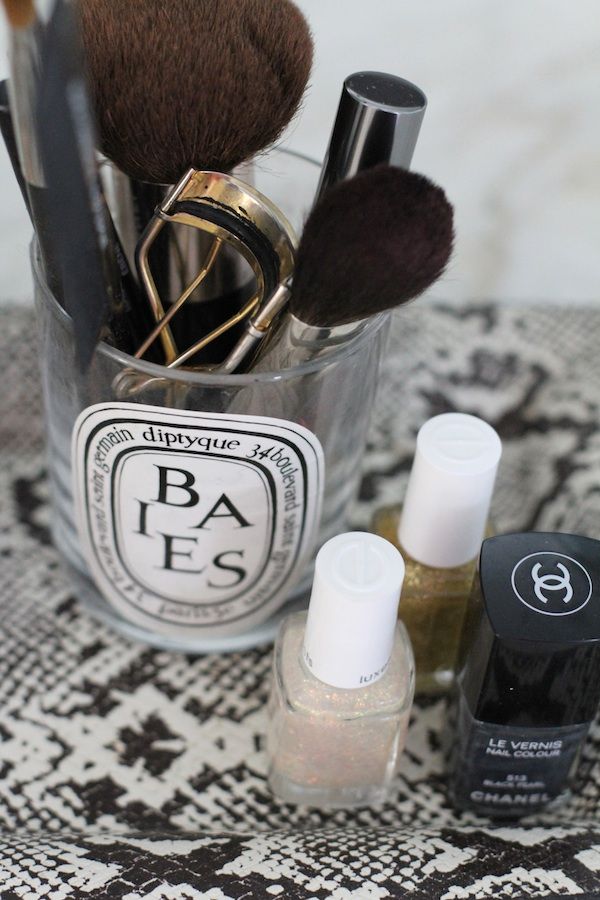
Where is `glass`? glass is located at coordinates (303, 400).